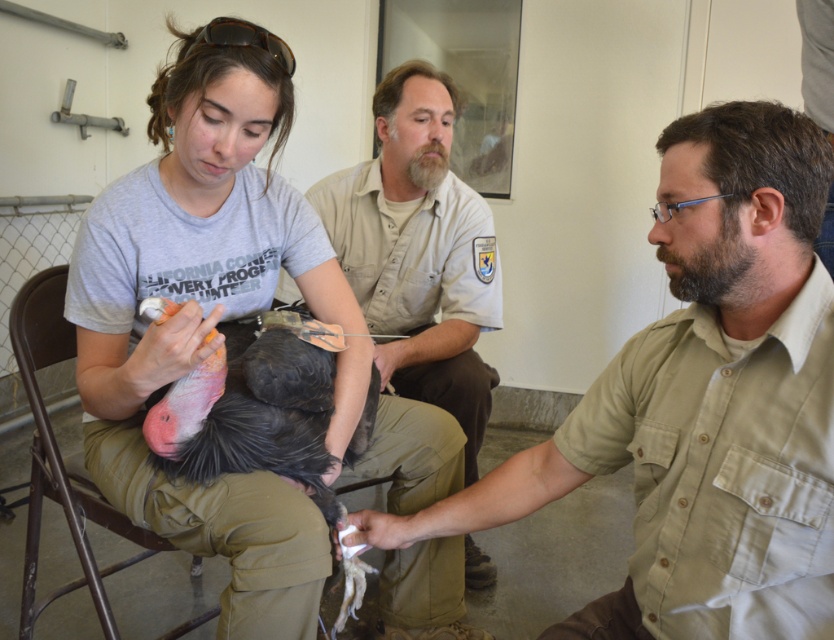
Question: Is matte gray shirt at center above metallic brown chair at lower left?

Choices:
 (A) yes
 (B) no

Answer: (A)

Question: Which point is closer to the camera taking this photo?

Choices:
 (A) (210, 285)
 (B) (106, 572)
 (C) (280, 298)
 (D) (789, 588)

Answer: (D)

Question: Which point is closer to the camera taking this photo?

Choices:
 (A) (451, 332)
 (B) (203, 241)
 (C) (697, 584)

Answer: (C)

Question: Is khaki uniform shirt at center bigger than metallic brown chair at lower left?

Choices:
 (A) no
 (B) yes

Answer: (B)

Question: Estimate the real-world distances between objects in this image. Which object is closer to the khaki uniform shirt at center?

Choices:
 (A) matte gray shirt at center
 (B) metallic brown chair at lower left

Answer: (A)

Question: Does khaki uniform shirt at center have a lesser width compared to metallic brown chair at lower left?

Choices:
 (A) yes
 (B) no

Answer: (B)